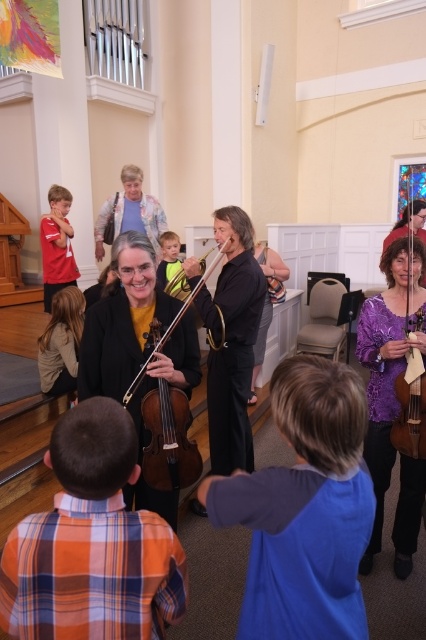
Is purple satin dress at center positioned behind matte red shirt at left?

No, purple satin dress at center is closer to the viewer.

Is point (403, 509) farther from viewer compared to point (51, 188)?

That is False.

The image size is (426, 640). I want to click on purple satin dress at center, so click(x=388, y=364).

Between wooden cello at center and matte red shirt at left, which one appears on the right side from the viewer's perspective?

From the viewer's perspective, wooden cello at center appears more on the right side.

Looking at this image, who is positioned more to the left, wooden cello at center or matte red shirt at left?

From the viewer's perspective, matte red shirt at left appears more on the left side.

Which is in front, point (422, 244) or point (43, 300)?

Positioned in front is point (422, 244).

At what (x,y) coordinates should I click in order to perform the action: click on wooden cello at center. Please return your answer as a coordinate pair (x, y). The height and width of the screenshot is (640, 426). Looking at the image, I should click on (411, 408).

Is matte black violin at center in front of light brown hair at lower left?

Yes, it is in front of light brown hair at lower left.

Who is positioned more to the right, matte black violin at center or light brown hair at lower left?

matte black violin at center

Is point (129, 387) farther from viewer compared to point (58, 356)?

That is False.

I want to click on matte black violin at center, so click(169, 442).